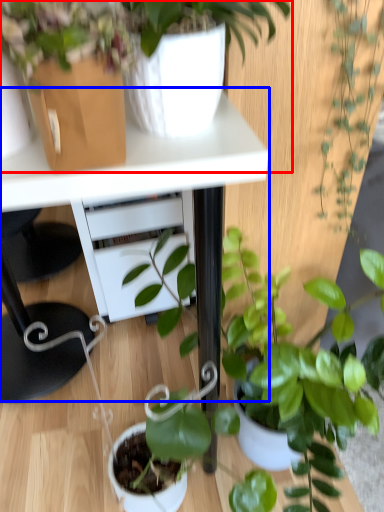
Question: Which object appears farthest to the camera in this image, houseplant (highlighted by a red box) or table (highlighted by a blue box)?

Choices:
 (A) houseplant
 (B) table

Answer: (B)